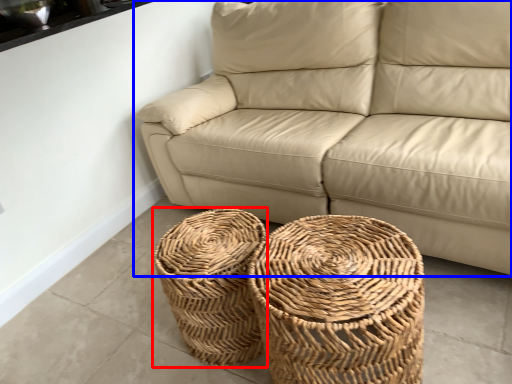
Question: Which object appears farthest to the camera in this image, basket (highlighted by a red box) or studio couch (highlighted by a blue box)?

Choices:
 (A) basket
 (B) studio couch

Answer: (A)